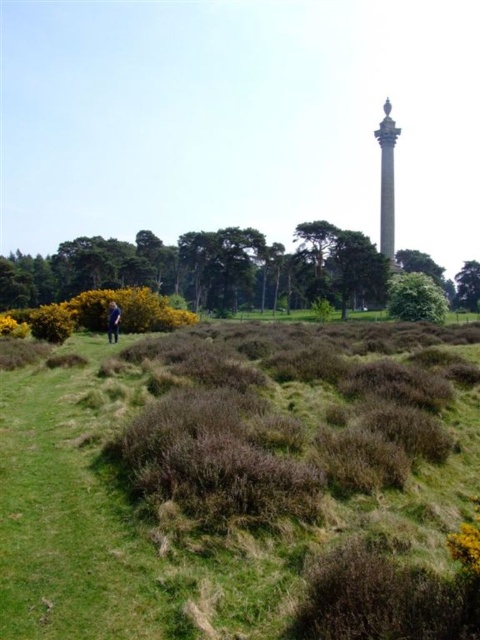
Question: Which object is positioned closest to the green grass at center?

Choices:
 (A) green leafy tree at lower left
 (B) smooth gray column at upper right

Answer: (B)

Question: Can you confirm if green leafy tree at lower left is thinner than green leafy tree at upper right?

Choices:
 (A) yes
 (B) no

Answer: (B)

Question: Is green leafy tree at lower left thinner than smooth gray column at upper right?

Choices:
 (A) no
 (B) yes

Answer: (A)

Question: Among these objects, which one is farthest from the camera?

Choices:
 (A) green grass at center
 (B) smooth gray column at upper right
 (C) green leafy tree at center
 (D) blue denim jeans at lower left

Answer: (B)

Question: Estimate the real-world distances between objects in this image. Which object is farther from the blue denim jeans at lower left?

Choices:
 (A) green leafy tree at lower left
 (B) green leafy tree at upper right
 (C) green grass at center
 (D) green leafy tree at center

Answer: (B)

Question: Is green leafy tree at lower left below smooth gray column at upper right?

Choices:
 (A) no
 (B) yes

Answer: (B)